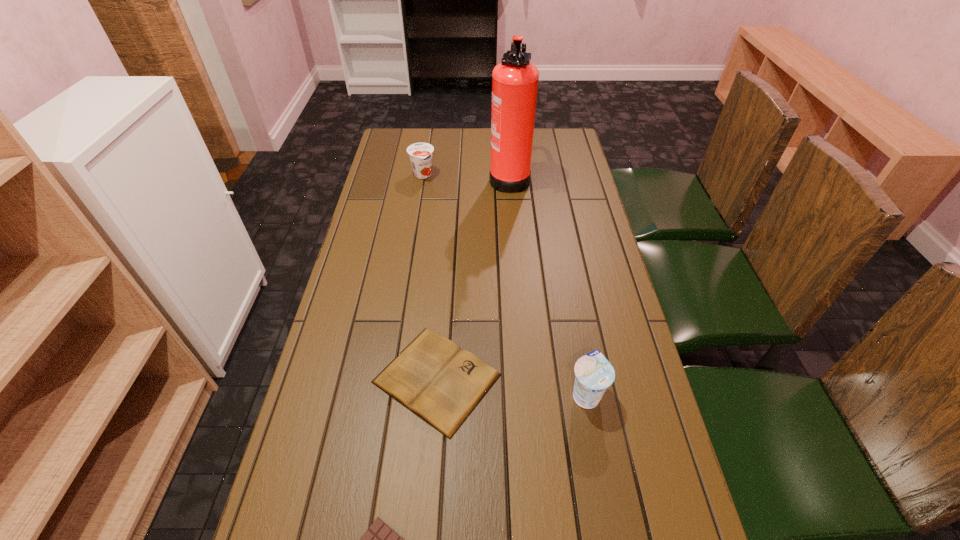
Where is `the tallest object`? The image size is (960, 540). the tallest object is located at coordinates (515, 80).

This screenshot has height=540, width=960. I want to click on the rightmost object, so click(x=594, y=373).

Locate an element on the screen. the right yogurt is located at coordinates (594, 373).

Image resolution: width=960 pixels, height=540 pixels. In order to click on the left yogurt in this screenshot , I will do `click(420, 154)`.

Identify the location of book. This screenshot has height=540, width=960. (433, 377).

I want to click on vacant space located 0.330m at the nozzle of the tallest object, so click(401, 176).

Image resolution: width=960 pixels, height=540 pixels. I want to click on vacant space located at the nozzle of the tallest object, so click(473, 176).

The height and width of the screenshot is (540, 960). I want to click on free space located at the nozzle of the tallest object, so click(401, 176).

Find the location of `vacant space located on the front of the nearer yogurt`. vacant space located on the front of the nearer yogurt is located at coordinates tap(599, 469).

This screenshot has width=960, height=540. I want to click on vacant space situated 0.120m on the back of the farther yogurt, so click(x=426, y=151).